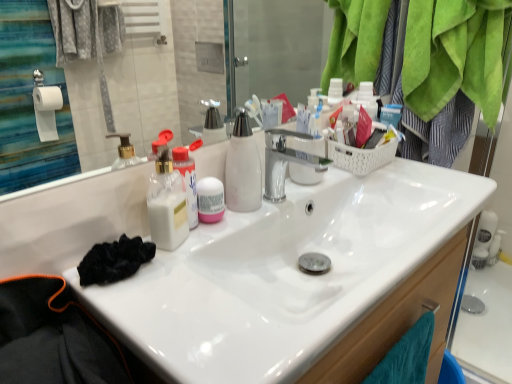
Question: From the image's perspective, is pink matte deodorant at center located beneath white glossy sink at center?

Choices:
 (A) no
 (B) yes

Answer: (A)

Question: Is white glossy sink at center located within pink matte deodorant at center?

Choices:
 (A) no
 (B) yes

Answer: (A)

Question: Does pink matte deodorant at center come in front of white glossy sink at center?

Choices:
 (A) yes
 (B) no

Answer: (B)

Question: Is pink matte deodorant at center wider than white glossy sink at center?

Choices:
 (A) no
 (B) yes

Answer: (A)

Question: Can you confirm if pink matte deodorant at center is shorter than white glossy sink at center?

Choices:
 (A) yes
 (B) no

Answer: (A)

Question: Is white glossy sink at center at the back of pink matte deodorant at center?

Choices:
 (A) no
 (B) yes

Answer: (A)

Question: Could you tell me if white glossy sink at center is turned towards pink matte deodorant at center?

Choices:
 (A) yes
 (B) no

Answer: (B)

Question: From the image's perspective, is white glossy sink at center above pink matte deodorant at center?

Choices:
 (A) yes
 (B) no

Answer: (B)

Question: Is white glossy sink at center to the left of pink matte deodorant at center from the viewer's perspective?

Choices:
 (A) yes
 (B) no

Answer: (B)

Question: Is white glossy sink at center wider than pink matte deodorant at center?

Choices:
 (A) yes
 (B) no

Answer: (A)

Question: From a real-world perspective, is white glossy sink at center located higher than pink matte deodorant at center?

Choices:
 (A) no
 (B) yes

Answer: (A)

Question: Considering the relative positions of white glossy sink at center and pink matte deodorant at center in the image provided, is white glossy sink at center in front of pink matte deodorant at center?

Choices:
 (A) no
 (B) yes

Answer: (B)

Question: Based on their positions, is pink matte deodorant at center located to the left or right of white glossy sink at center?

Choices:
 (A) right
 (B) left

Answer: (B)